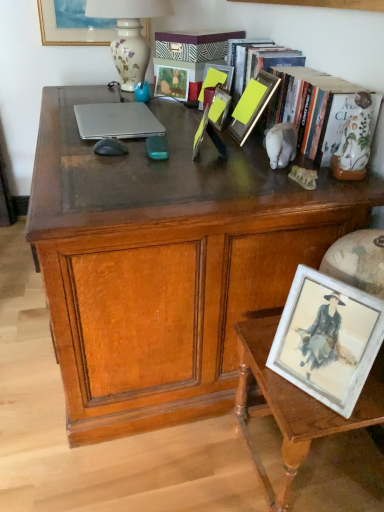
Question: Is hardcover book at upper right wider or thinner than matte wooden picture frame at center, which appears as the 2th picture frame when viewed from the back?

Choices:
 (A) thin
 (B) wide

Answer: (B)

Question: From a real-world perspective, is hardcover book at upper right physically located above or below matte wooden picture frame at center, arranged as the 3th picture frame when viewed from the top?

Choices:
 (A) above
 (B) below

Answer: (A)

Question: Which object is the closest to the silver metallic laptop at center?

Choices:
 (A) porcelain floral lamp at upper center
 (B) matte wooden picture frame at center, which appears as the 2th picture frame when viewed from the back
 (C) yellow matte picture frame at center, placed as the 2th picture frame when sorted from bottom to top
 (D) matte wooden picture frame at upper center, which appears as the 5th picture frame when viewed from the front
 (E) white glossy picture frame at lower right, marked as the seventh picture frame in a top-to-bottom arrangement

Answer: (D)

Question: Estimate the real-world distances between objects in this image. Which object is closer to the matte glass picture frame at center, the 4th picture frame in the bottom-to-top sequence?

Choices:
 (A) wooden desk at center
 (B) transparent plastic mobile phone at center
 (C) matte glass picture frame at center, which is counted as the 3th picture frame, starting from the front
 (D) matte gold picture frame at upper left, arranged as the 7th picture frame when ordered from the bottom
 (E) porcelain floral lamp at upper center

Answer: (C)